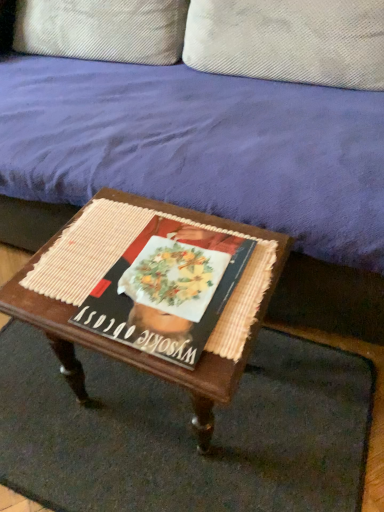
The image size is (384, 512). I want to click on vacant space behind matte paper magazine at center, so click(x=145, y=216).